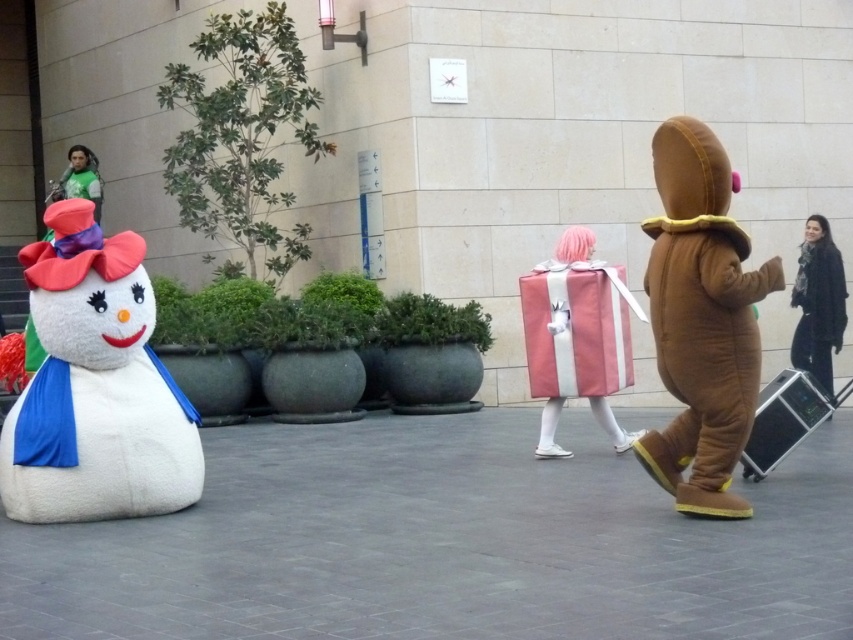
You are standing at the center of the image and want to move towards the white plush snowman at left. Based on the coordinates provided, in which direction should you move?

The white plush snowman at left is located at coordinates point (96, 387), so you should move to the left to reach it.